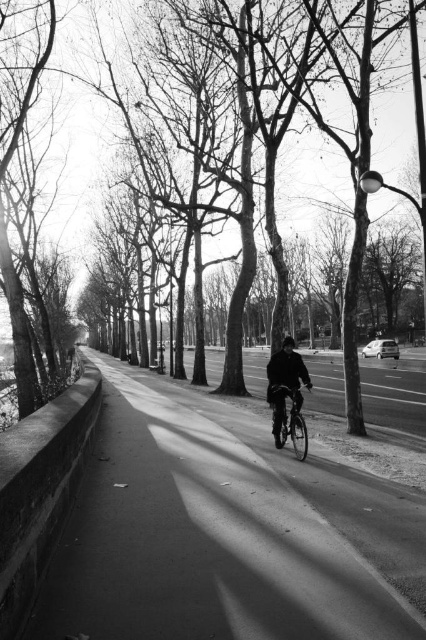
You are a cyclist planning to ride along the asphalt bike path at center. There is a smooth bark tree at center nearby. How far apart are these two objects?

The asphalt bike path at center and the smooth bark tree at center are 79.61 feet apart from each other.

You are a photographer planning to capture a cyclist in a dark matte jacket at center riding a shiny metallic bicycle at center. Given the scene described, which object would appear wider in your photograph?

The dark matte jacket at center is wider than the shiny metallic bicycle at center in the photograph.